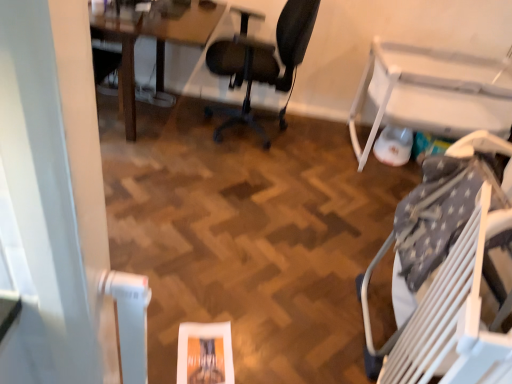
Question: Is wooden table at upper left, which appears as the second table when viewed from the right, inside or outside of black mesh office chair at center, which appears as the first chair when viewed from the left?

Choices:
 (A) outside
 (B) inside

Answer: (A)

Question: From a real-world perspective, is wooden table at upper left, placed as the first table when sorted from left to right, positioned above or below black mesh office chair at center, placed as the 1th chair when sorted from top to bottom?

Choices:
 (A) above
 (B) below

Answer: (B)

Question: Which is farther from the white plastic chair at lower right, the second chair when ordered from top to bottom?

Choices:
 (A) white plastic table at right, the 2th table when ordered from left to right
 (B) wooden table at upper left, placed as the first table when sorted from left to right
 (C) black mesh office chair at center, acting as the second chair starting from the right

Answer: (B)

Question: Estimate the real-world distances between objects in this image. Which object is farther from the white plastic table at right, which appears as the 1th table when viewed from the right?

Choices:
 (A) white plastic chair at lower right, the 1th chair from the right
 (B) wooden table at upper left, which appears as the second table when viewed from the right
 (C) black mesh office chair at center, which appears as the first chair when viewed from the left

Answer: (B)